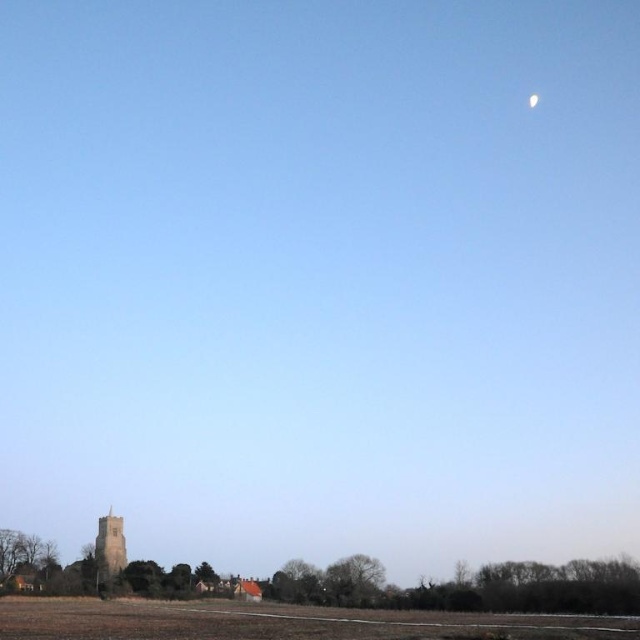
Question: Which of the following is the farthest from the observer?

Choices:
 (A) (104, 554)
 (B) (532, 96)

Answer: (B)

Question: Where is brown grassy field at lower center located in relation to brown stone tower at lower left in the image?

Choices:
 (A) left
 (B) right

Answer: (B)

Question: Can you confirm if brown grassy field at lower center is positioned to the left of white glossy moon at upper right?

Choices:
 (A) no
 (B) yes

Answer: (B)

Question: Can you confirm if brown grassy field at lower center is thinner than brown stone tower at lower left?

Choices:
 (A) yes
 (B) no

Answer: (B)

Question: Among these objects, which one is farthest from the camera?

Choices:
 (A) brown grassy field at lower center
 (B) white glossy moon at upper right

Answer: (B)

Question: Which object is positioned farthest from the brown stone tower at lower left?

Choices:
 (A) brown grassy field at lower center
 (B) white glossy moon at upper right

Answer: (B)